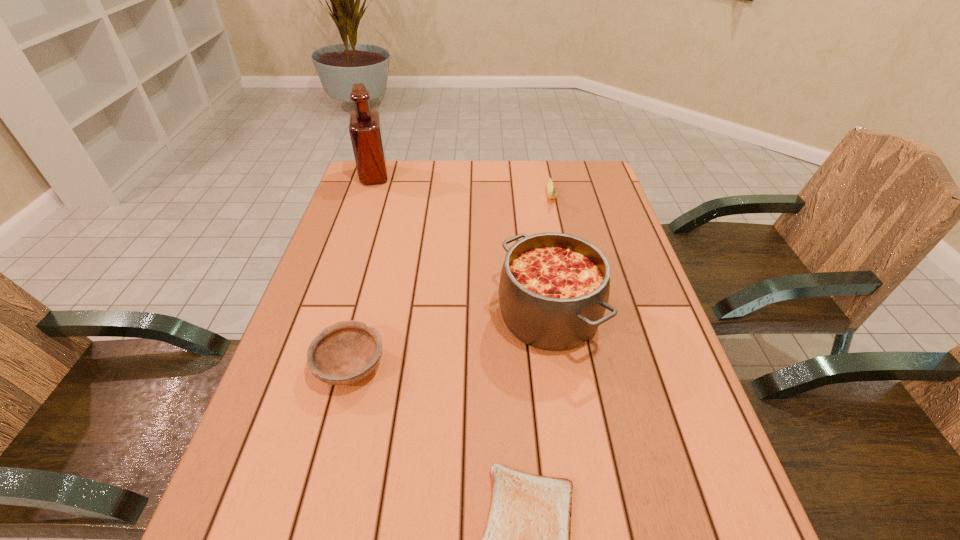
Find the location of a particular element. The height and width of the screenshot is (540, 960). free space between the bowl and the banana is located at coordinates (450, 281).

You are a GUI agent. You are given a task and a screenshot of the screen. Output one action in this format:
    pyautogui.click(x=<x>, y=<y>)
    Task: Click on the object that is the closest one to the bowl
    The image size is (960, 540).
    Given the screenshot: What is the action you would take?
    pyautogui.click(x=554, y=288)

Choose which object is the second nearest neighbor to the bowl. Please provide its 2D coordinates. Your answer should be formatted as a tuple, i.e. [(x, y)], where the tuple contains the x and y coordinates of a point satisfying the conditions above.

[(527, 536)]

At what (x,y) coordinates should I click in order to perform the action: click on vacant region that satisfies the following two spatial constraints: 1. on the front side of the tallest object; 2. on the right side of the casserole. Please return your answer as a coordinate pair (x, y). This screenshot has height=540, width=960. Looking at the image, I should click on (326, 316).

At what (x,y) coordinates should I click in order to perform the action: click on vacant area in the image that satisfies the following two spatial constraints: 1. on the front side of the bowl; 2. on the left side of the liquor. Please return your answer as a coordinate pair (x, y). The height and width of the screenshot is (540, 960). Looking at the image, I should click on (309, 366).